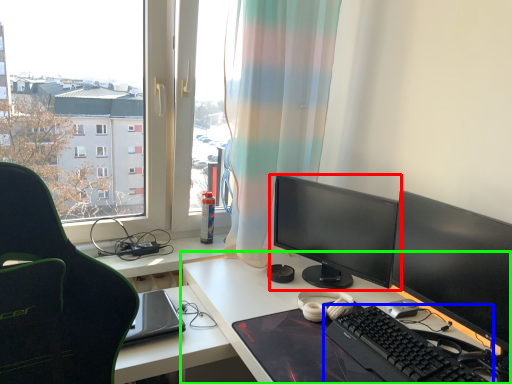
Question: Estimate the real-world distances between objects in this image. Which object is closer to computer monitor (highlighted by a red box), computer keyboard (highlighted by a blue box) or desk (highlighted by a green box)?

Choices:
 (A) computer keyboard
 (B) desk

Answer: (B)